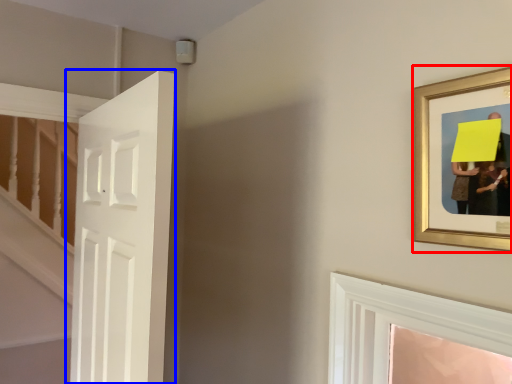
Question: Which object is closer to the camera taking this photo, picture frame (highlighted by a red box) or door (highlighted by a blue box)?

Choices:
 (A) picture frame
 (B) door

Answer: (A)